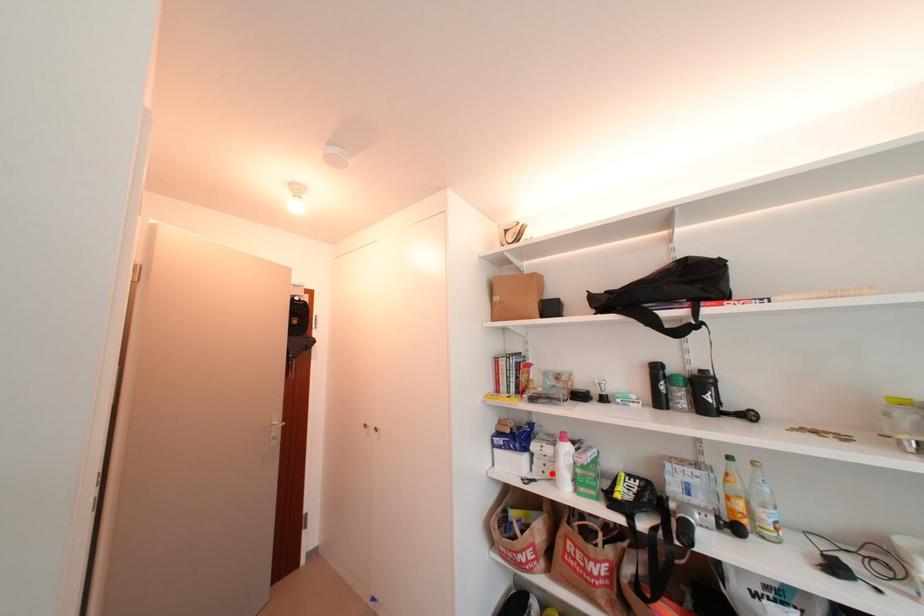
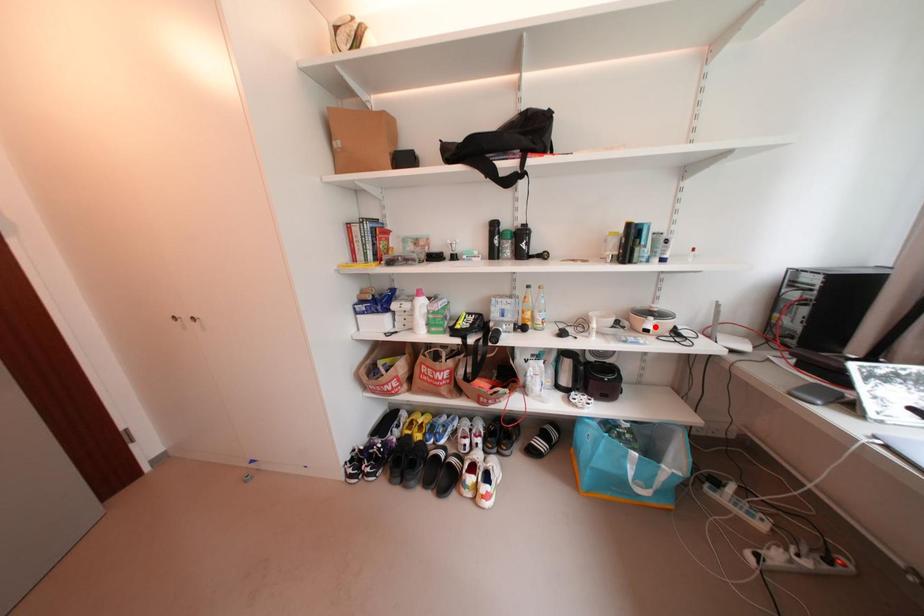
I am providing you with two images of the same scene from different viewpoints. A red point is marked on the first image and another point is marked on the second image. Do the highlighted points in image1 and image2 indicate the same real-world spot?

No